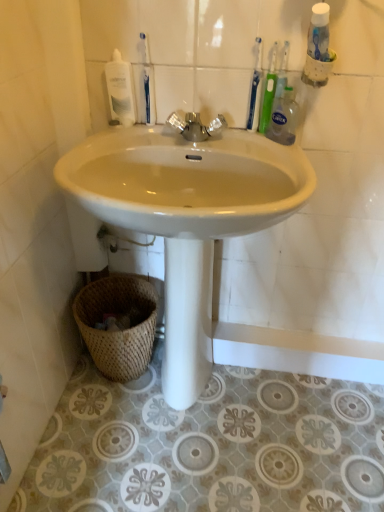
Locate an element on the screen. vacant space to the right of silver metallic faucet at center is located at coordinates (253, 145).